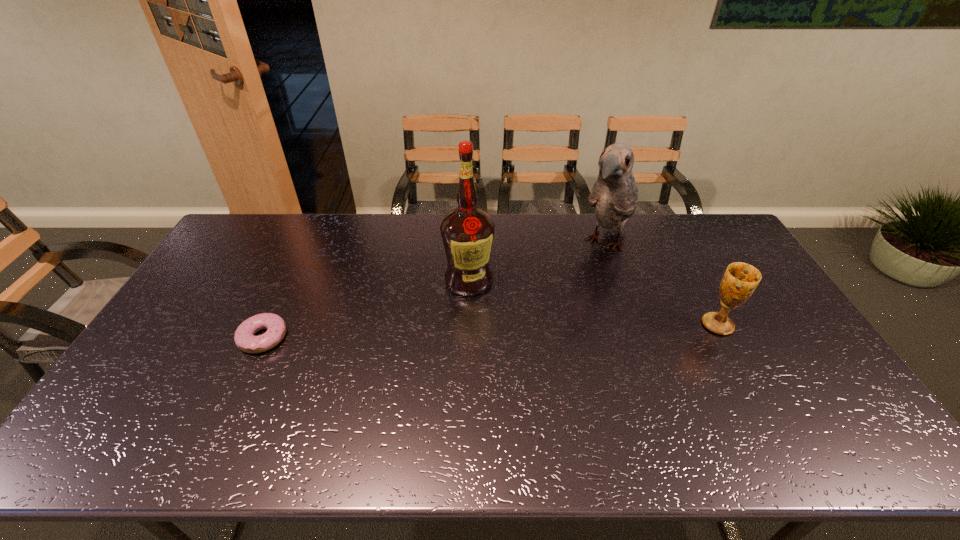
Find the location of a particular element. blank space at the far left corner of the desktop is located at coordinates (x=254, y=244).

Image resolution: width=960 pixels, height=540 pixels. Identify the location of vacant space at the near left corner of the desktop. (154, 411).

Where is `vacant space at the far right corner`? This screenshot has width=960, height=540. vacant space at the far right corner is located at coordinates (717, 230).

At what (x,y) coordinates should I click in order to perform the action: click on vacant region between the leftmost object and the parrot. Please return your answer as a coordinate pair (x, y). Looking at the image, I should click on (435, 291).

At what (x,y) coordinates should I click in order to perform the action: click on vacant region between the parrot and the leftmost object. Please return your answer as a coordinate pair (x, y). Looking at the image, I should click on (435, 291).

Where is `vacant space that's between the third object from right to left and the second object from right to left`? The image size is (960, 540). vacant space that's between the third object from right to left and the second object from right to left is located at coordinates (538, 262).

This screenshot has width=960, height=540. What are the coordinates of `free spot between the third object from right to left and the rightmost object` in the screenshot? It's located at (593, 302).

I want to click on vacant area between the third shortest object and the leftmost object, so click(435, 291).

The width and height of the screenshot is (960, 540). Identify the location of free space between the third tallest object and the second tallest object. (661, 284).

The height and width of the screenshot is (540, 960). What are the coordinates of `vacant point located between the chalice and the parrot` in the screenshot? It's located at (661, 284).